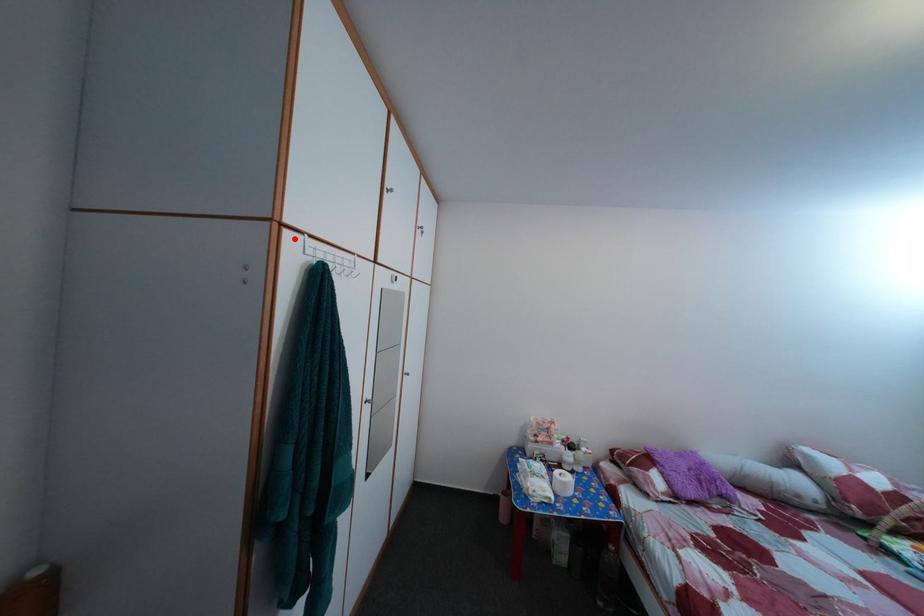
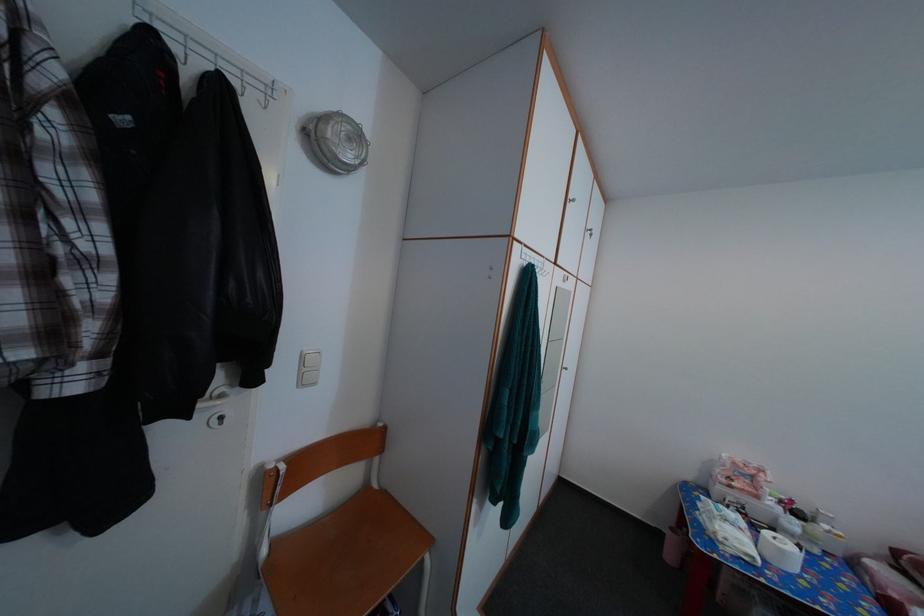
Find the pixel in the second image that matches the highlighted location in the first image.

(525, 251)